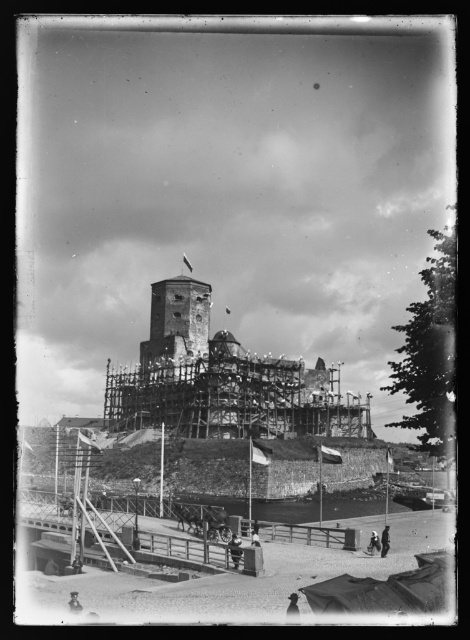
You are an architect inspecting the construction site of a castle. You see the wooden scaffolding at lower center and the rusty metal tower at center. Which object is positioned to the east of the other?

The wooden scaffolding at lower center is to the right of the rusty metal tower at center, so if the image is oriented with the tower at the center facing north, the scaffolding would be to the east of the tower.

You are an architect inspecting the construction site of the castle. You notice two points marked on your blueprint at coordinates point (300, 532) and point (170, 289). From your current vantage point, which point is closer to you?

Point (300, 532) is in front of point (170, 289), so from your current vantage point, point (300, 532) is closer to you.